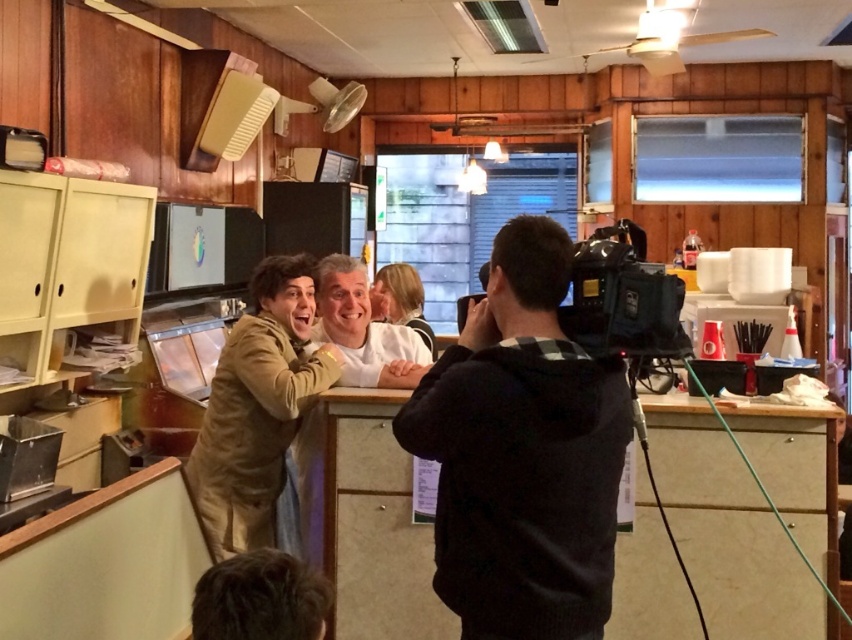
From the picture: Is black fabric camera at center positioned at the back of tan suede jacket at center?

No, it is not.

Does black fabric camera at center have a greater width compared to tan suede jacket at center?

No, black fabric camera at center is not wider than tan suede jacket at center.

Does point (591, 556) come in front of point (286, 422)?

Yes.

At what (x,y) coordinates should I click in order to perform the action: click on black fabric camera at center. Please return your answer as a coordinate pair (x, y). Image resolution: width=852 pixels, height=640 pixels. Looking at the image, I should click on pyautogui.click(x=522, y=452).